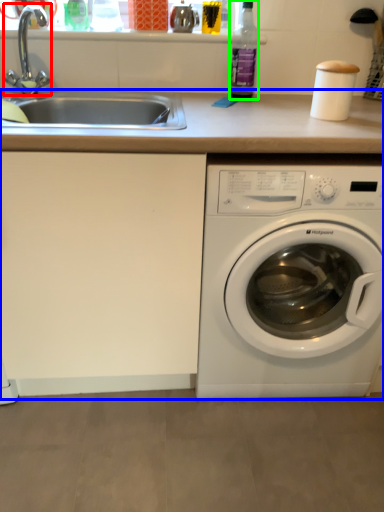
Question: Considering the real-world distances, which object is farthest from faucet (highlighted by a red box)? counter top (highlighted by a blue box) or bottle (highlighted by a green box)?

Choices:
 (A) counter top
 (B) bottle

Answer: (A)